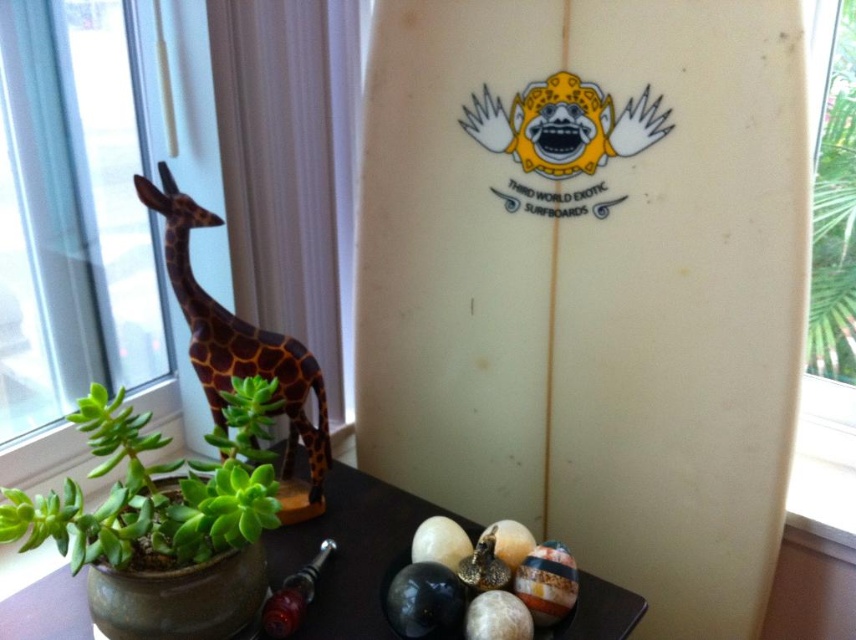
Question: Where is smooth dark wood table at lower center located in relation to shiny red glass pipe at lower left in the image?

Choices:
 (A) right
 (B) left

Answer: (A)

Question: Which object is the closest to the green succulent at lower left?

Choices:
 (A) white matte surfboard at center
 (B) brown wooden giraffe at left

Answer: (B)

Question: Which is farther from the smooth dark wood table at lower center?

Choices:
 (A) brown wooden giraffe at left
 (B) green leafy plant at upper right
 (C) green succulent at lower left
 (D) shiny red glass pipe at lower left

Answer: (B)

Question: Does white matte surfboard at center appear under smooth dark wood table at lower center?

Choices:
 (A) yes
 (B) no

Answer: (B)

Question: Can you confirm if white matte surfboard at center is positioned below smooth dark wood table at lower center?

Choices:
 (A) no
 (B) yes

Answer: (A)

Question: Which object is the farthest from the white matte surfboard at center?

Choices:
 (A) smooth dark wood table at lower center
 (B) green succulent at lower left
 (C) shiny red glass pipe at lower left
 (D) brown wooden giraffe at left

Answer: (C)